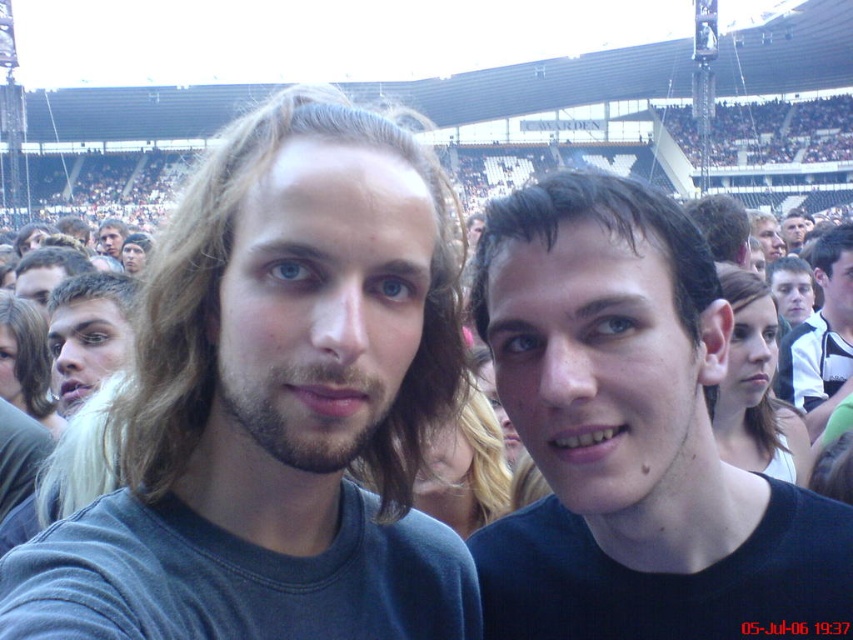
Who is more distant from viewer, (605, 307) or (848, 301)?

Point (848, 301)

Can you confirm if black matte shirt at center is smaller than smooth black shirt at center?

No.

Who is more distant from viewer, (x=602, y=385) or (x=834, y=260)?

The point (x=834, y=260) is behind.

Locate an element on the screen. Image resolution: width=853 pixels, height=640 pixels. black matte shirt at center is located at coordinates (633, 436).

Does dark gray t-shirt at center appear over smooth black shirt at center?

No, dark gray t-shirt at center is not above smooth black shirt at center.

From the picture: Does dark gray t-shirt at center lie in front of smooth black shirt at center?

That is True.

Is point (270, 100) in front of point (846, 230)?

That is False.

I want to click on dark gray t-shirt at center, so click(x=276, y=404).

Can you confirm if dark gray t-shirt at center is smaller than blonde hair at left?

Incorrect, dark gray t-shirt at center is not smaller in size than blonde hair at left.

Can you confirm if dark gray t-shirt at center is positioned below blonde hair at left?

Yes.

Is point (258, 346) more distant than point (64, 284)?

No, it is not.

Locate an element on the screen. This screenshot has height=640, width=853. dark gray t-shirt at center is located at coordinates (276, 404).